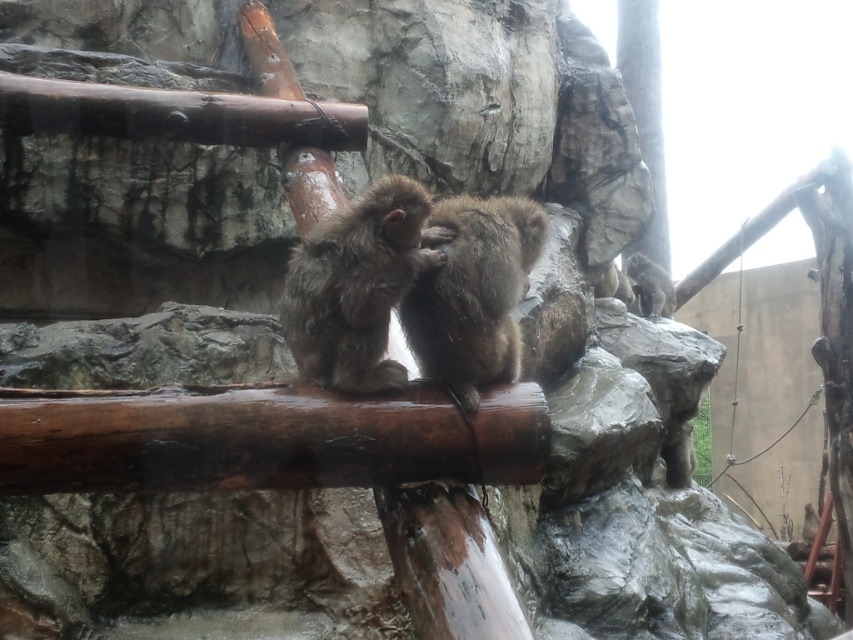
Question: Is brown furry monkey at center positioned at the back of fuzzy brown monkey at center?

Choices:
 (A) yes
 (B) no

Answer: (B)

Question: Estimate the real-world distances between objects in this image. Which object is farther from the fuzzy brown monkey at center?

Choices:
 (A) brown furry monkey at center
 (B) fuzzy brown monkey at upper right

Answer: (B)

Question: Which of the following is the farthest from the observer?

Choices:
 (A) (340, 385)
 (B) (471, 376)

Answer: (B)

Question: Is fuzzy brown monkey at center further to camera compared to fuzzy brown monkey at upper right?

Choices:
 (A) no
 (B) yes

Answer: (A)

Question: Which of the following is the farthest from the observer?

Choices:
 (A) fuzzy brown monkey at center
 (B) fuzzy brown monkey at upper right
 (C) brown furry monkey at center

Answer: (B)

Question: Is fuzzy brown monkey at center to the left of fuzzy brown monkey at upper right from the viewer's perspective?

Choices:
 (A) yes
 (B) no

Answer: (A)